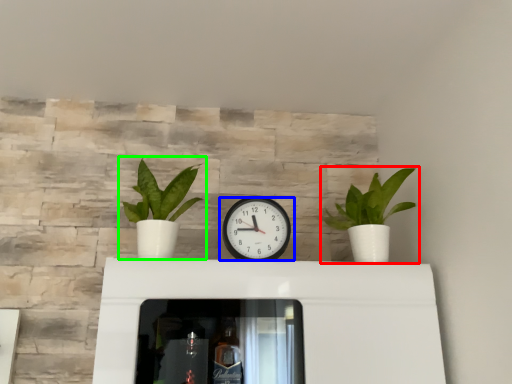
Question: Considering the real-world distances, which object is farthest from houseplant (highlighted by a red box)? wall clock (highlighted by a blue box) or houseplant (highlighted by a green box)?

Choices:
 (A) wall clock
 (B) houseplant

Answer: (B)